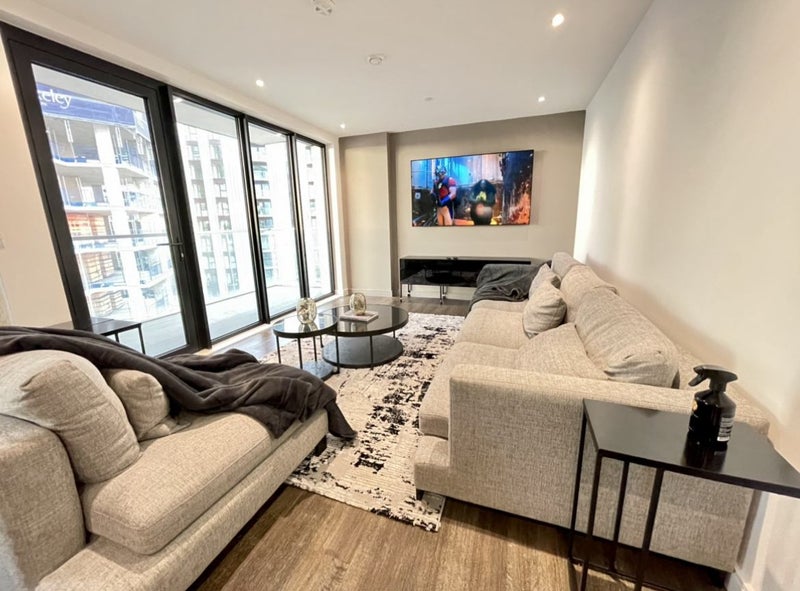
Where is `blanket`? This screenshot has width=800, height=591. blanket is located at coordinates (230, 398).